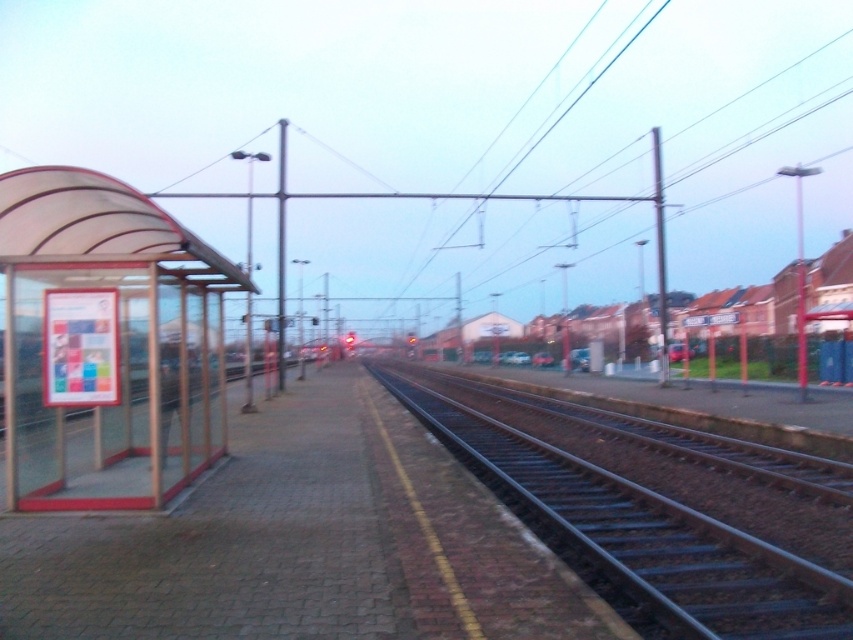
Is transparent plastic bus stop at left taller than black steel train track at center?

Indeed, transparent plastic bus stop at left has a greater height compared to black steel train track at center.

Which is above, transparent plastic bus stop at left or black steel train track at center?

transparent plastic bus stop at left is above.

Measure the distance between point (82,372) and camera.

7.51 meters

Locate an element on the screen. This screenshot has width=853, height=640. transparent plastic bus stop at left is located at coordinates (107, 342).